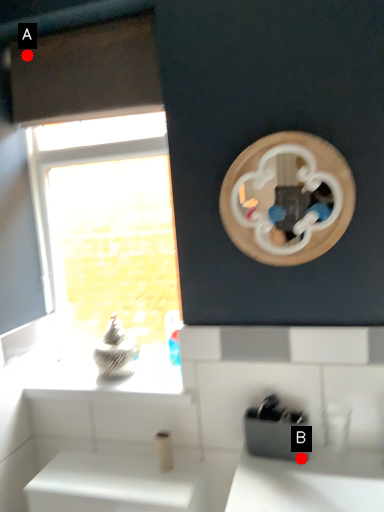
Question: Two points are circled on the image, labeled by A and B beside each circle. Among these points, which one is nearest to the camera?

Choices:
 (A) A is closer
 (B) B is closer

Answer: (B)